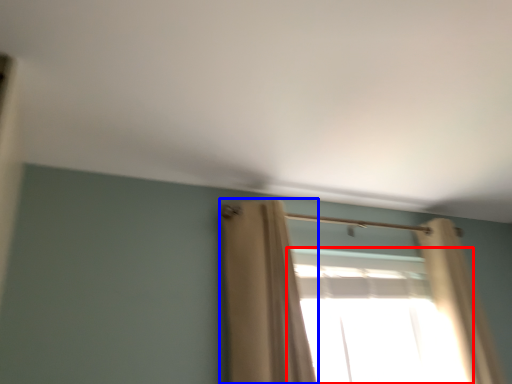
Question: Which point is further to the camera, window (highlighted by a red box) or curtain (highlighted by a blue box)?

Choices:
 (A) window
 (B) curtain

Answer: (A)